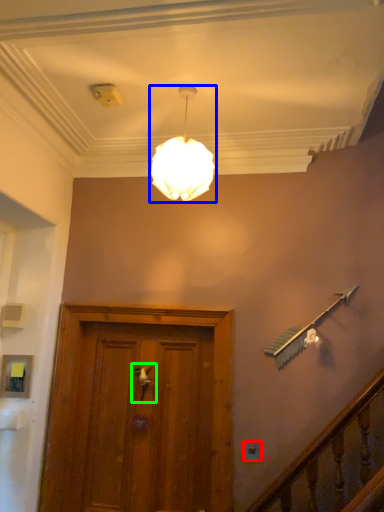
Question: Considering the real-world distances, which object is closest to electric outlet (highlighted by a red box)? lamp (highlighted by a blue box) or door handle (highlighted by a green box).

Choices:
 (A) lamp
 (B) door handle

Answer: (B)